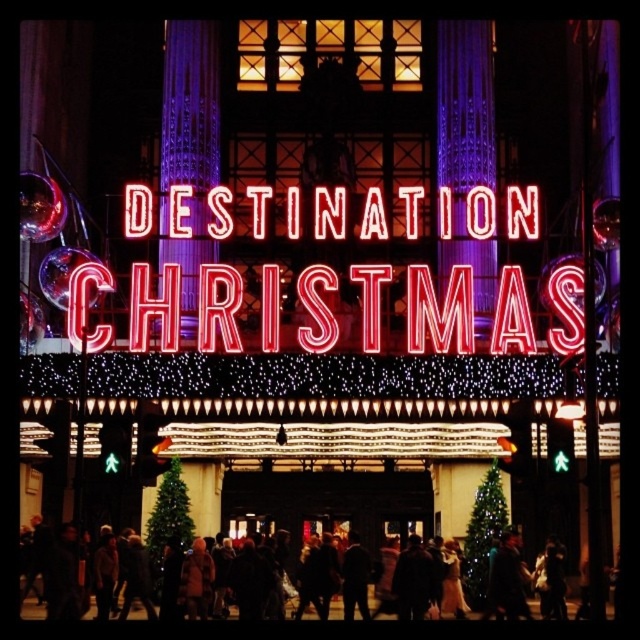
Can you confirm if green matte christmas tree at lower center is shorter than dark brown leather jacket at center?

No.

Identify the location of green matte christmas tree at lower center. This screenshot has height=640, width=640. (483, 538).

Find the location of a particular element. green matte christmas tree at lower center is located at coordinates (483, 538).

I want to click on neon sign at center, so click(440, 310).

Who is positioned more to the right, neon sign at center or dark brown coat at lower center?

Positioned to the right is neon sign at center.

Between point (317, 282) and point (108, 525), which one is positioned in front?

Point (317, 282) is in front.

Identify the location of neon sign at center. (440, 310).

Does neon sign at center have a lesser width compared to green matte christmas tree at lower center?

In fact, neon sign at center might be wider than green matte christmas tree at lower center.

Can you confirm if neon sign at center is positioned to the right of green matte christmas tree at lower center?

No, neon sign at center is not to the right of green matte christmas tree at lower center.

Does point (497, 296) come in front of point (483, 577)?

Yes, it is.

Where is `neon sign at center`? This screenshot has height=640, width=640. neon sign at center is located at coordinates (440, 310).